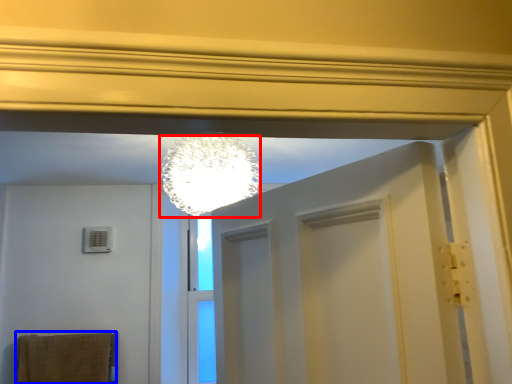
Question: Which point is closer to the camera, lamp (highlighted by a red box) or bath towel (highlighted by a blue box)?

Choices:
 (A) lamp
 (B) bath towel

Answer: (A)